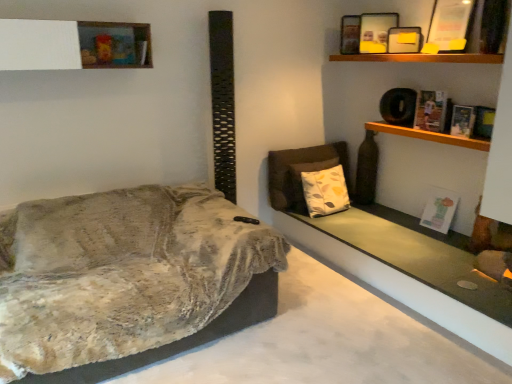
Question: Is point (70, 56) positioned closer to the camera than point (479, 119)?

Choices:
 (A) farther
 (B) closer

Answer: (B)

Question: From their relative heights in the image, would you say white matte shelf at upper left, the 1th shelf when ordered from top to bottom, is taller or shorter than hardcover book at upper right, placed as the second book when sorted from bottom to top?

Choices:
 (A) short
 (B) tall

Answer: (B)

Question: Estimate the real-world distances between objects in this image. Which object is farther from the matte black picture frame at upper right, placed as the first picture frame when sorted from back to front?

Choices:
 (A) white printed cushion at center
 (B) velvet beige couch at left
 (C) hardcover book at upper right, the 3th book when ordered from top to bottom
 (D) matte paper book at upper right, the fourth book when ordered from bottom to top
 (E) hardcover book at upper right, the 2th book positioned from the top

Answer: (B)

Question: Considering the real-world distances, which object is closest to the hardcover book at upper right, the 2th book positioned from the top?

Choices:
 (A) hardcover book at upper right, placed as the second book when sorted from bottom to top
 (B) matte paper book at upper right, the fourth book when ordered from bottom to top
 (C) matte black picture frame at upper center, marked as the second picture frame in a back-to-front arrangement
 (D) white paper at upper right, the first book in the bottom-to-top sequence
 (E) smooth concrete window sill at lower right

Answer: (A)